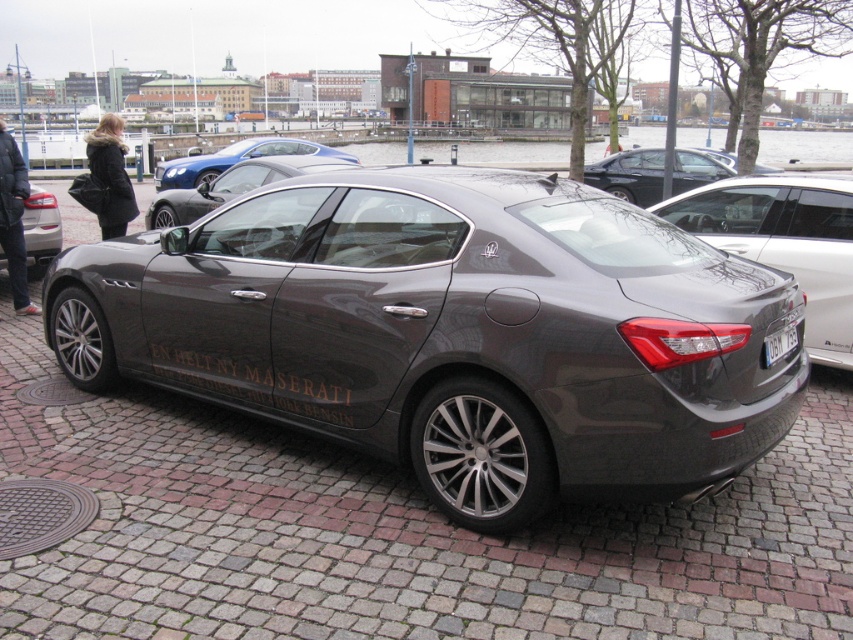
Who is lower down, satin dark gray car at center or dark gray metallic sedan at upper right?

Positioned lower is satin dark gray car at center.

Describe the element at coordinates (785, 243) in the screenshot. I see `satin dark gray car at center` at that location.

I want to click on satin dark gray car at center, so click(x=785, y=243).

Who is taller, satin dark gray car at center or satin blue car at center?

satin blue car at center

Does point (763, 198) come in front of point (306, 145)?

Yes, it is.

Where is `satin dark gray car at center`? The image size is (853, 640). satin dark gray car at center is located at coordinates (785, 243).

Between satin black car at center and matte black car at left, which one has less height?

satin black car at center

Image resolution: width=853 pixels, height=640 pixels. What do you see at coordinates (231, 186) in the screenshot?
I see `satin black car at center` at bounding box center [231, 186].

Where is `satin black car at center`? satin black car at center is located at coordinates (231, 186).